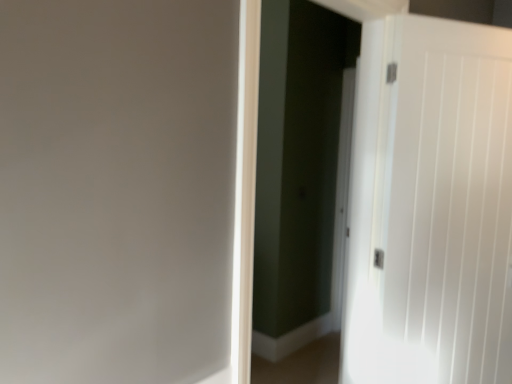
Identify the location of white glossy screen door at center. The height and width of the screenshot is (384, 512). (300, 172).

Describe the element at coordinates (300, 172) in the screenshot. The image size is (512, 384). I see `white glossy screen door at center` at that location.

Image resolution: width=512 pixels, height=384 pixels. I want to click on white smooth door at right, so click(x=430, y=205).

The image size is (512, 384). What do you see at coordinates (430, 205) in the screenshot?
I see `white smooth door at right` at bounding box center [430, 205].

Measure the distance between white smooth door at right and camera.

white smooth door at right is 1.66 meters from camera.

The height and width of the screenshot is (384, 512). Identify the location of white glossy screen door at center. (300, 172).

Is white glossy screen door at center at the left side of white smooth door at right?

Yes.

Does white glossy screen door at center lie behind white smooth door at right?

No, it is in front of white smooth door at right.

Between point (320, 299) and point (441, 174), which one is positioned in front?

Point (441, 174)

From the image's perspective, relative to white smooth door at right, is white glossy screen door at center above or below?

white glossy screen door at center is above white smooth door at right.

From the picture: From a real-world perspective, is white glossy screen door at center above or below white smooth door at right?

In terms of real-world spatial position, white glossy screen door at center is above white smooth door at right.

Is white glossy screen door at center thinner than white smooth door at right?

Incorrect, the width of white glossy screen door at center is not less than that of white smooth door at right.

Can you confirm if white glossy screen door at center is taller than white smooth door at right?

Indeed, white glossy screen door at center has a greater height compared to white smooth door at right.

In the scene shown: Is white glossy screen door at center bigger or smaller than white smooth door at right?

white glossy screen door at center is bigger than white smooth door at right.

Would you say white glossy screen door at center is inside or outside white smooth door at right?

white glossy screen door at center lies outside white smooth door at right.

Would you consider white glossy screen door at center to be distant from white smooth door at right?

Yes.

Is white glossy screen door at center facing towards white smooth door at right?

No, white glossy screen door at center does not turn towards white smooth door at right.

Can you tell me how much white glossy screen door at center and white smooth door at right differ in facing direction?

There is a 30.4-degree angle between the facing directions of white glossy screen door at center and white smooth door at right.

This screenshot has height=384, width=512. I want to click on screen door lying in front of the white smooth door at right, so click(300, 172).

Considering the relative positions of white smooth door at right and white glossy screen door at center in the image provided, is white smooth door at right to the left or to the right of white glossy screen door at center?

white smooth door at right is to the right of white glossy screen door at center.

Which object is closer to the camera taking this photo, white smooth door at right or white glossy screen door at center?

white glossy screen door at center is closer to the camera.

Which is closer to the camera, (477, 68) or (319, 218)?

Positioned in front is point (477, 68).

From the image's perspective, does white smooth door at right appear lower than white glossy screen door at center?

Correct, white smooth door at right appears lower than white glossy screen door at center in the image.

From a real-world perspective, between white smooth door at right and white glossy screen door at center, who is vertically lower?

white smooth door at right is physically lower.

Can you confirm if white smooth door at right is thinner than white glossy screen door at center?

Indeed, white smooth door at right has a lesser width compared to white glossy screen door at center.

In terms of height, does white smooth door at right look taller or shorter compared to white glossy screen door at center?

In the image, white smooth door at right appears to be shorter than white glossy screen door at center.

Considering the sizes of objects white smooth door at right and white glossy screen door at center in the image provided, who is smaller, white smooth door at right or white glossy screen door at center?

white smooth door at right is smaller.

Is white smooth door at right outside of white glossy screen door at center?

Yes, white smooth door at right is outside of white glossy screen door at center.

Are white smooth door at right and white glossy screen door at center beside each other?

white smooth door at right and white glossy screen door at center are clearly separated.

Is white smooth door at right facing away from white glossy screen door at center?

No, white glossy screen door at center is not at the back of white smooth door at right.

What's the angular difference between white smooth door at right and white glossy screen door at center's facing directions?

They differ by 30.4 degrees in their facing directions.

Measure the distance between white smooth door at right and white glossy screen door at center.

white smooth door at right and white glossy screen door at center are 1.26 meters apart.

Identify the location of door on the right side of white glossy screen door at center. (430, 205).

Locate an element on the screen. This screenshot has height=384, width=512. door that is below the white glossy screen door at center (from the image's perspective) is located at coordinates (430, 205).

Locate an element on the screen. screen door above the white smooth door at right (from a real-world perspective) is located at coordinates (300, 172).